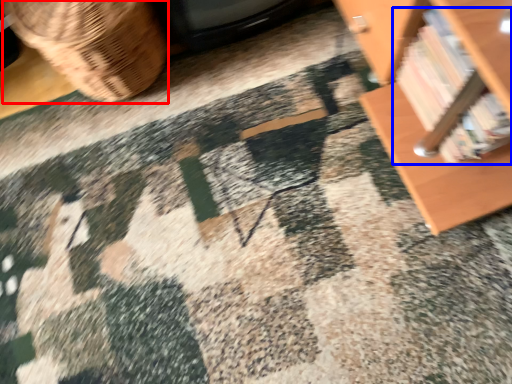
Question: Which object is further to the camera taking this photo, basket (highlighted by a red box) or book (highlighted by a blue box)?

Choices:
 (A) basket
 (B) book

Answer: (A)